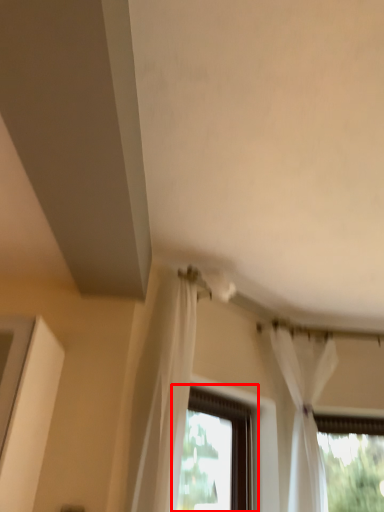
Question: In this image, where is window (annotated by the red box) located relative to curtain?

Choices:
 (A) left
 (B) right

Answer: (A)